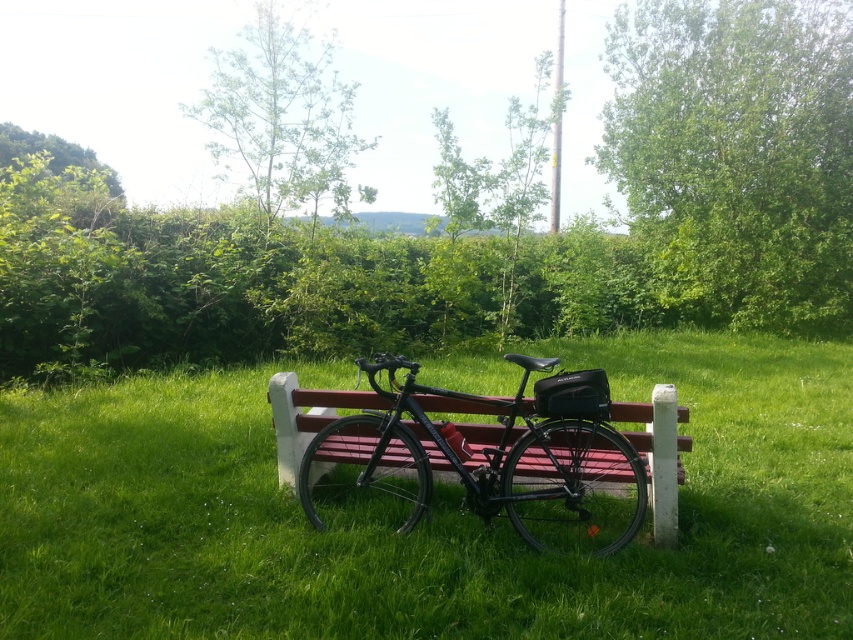
Question: Does green grass at center have a larger size compared to green leafy tree at upper center?

Choices:
 (A) no
 (B) yes

Answer: (A)

Question: Which point is closer to the camera?

Choices:
 (A) green leafy tree at upper right
 (B) green leafy tree at upper center
 (C) green grass at center
 (D) shiny black bicycle at center

Answer: (C)

Question: Is green leafy tree at upper center to the right of green leafy tree at upper left from the viewer's perspective?

Choices:
 (A) yes
 (B) no

Answer: (A)

Question: Which is farther from the shiny black bicycle at center?

Choices:
 (A) green leafy tree at upper right
 (B) green leafy tree at upper left
 (C) green grass at center
 (D) green leafy tree at upper center

Answer: (B)

Question: Which point is farther to the camera?

Choices:
 (A) green leafy tree at upper center
 (B) green leafy tree at upper left
 (C) green leafy tree at upper right

Answer: (B)

Question: Is green grass at center above green leafy tree at upper center?

Choices:
 (A) yes
 (B) no

Answer: (B)